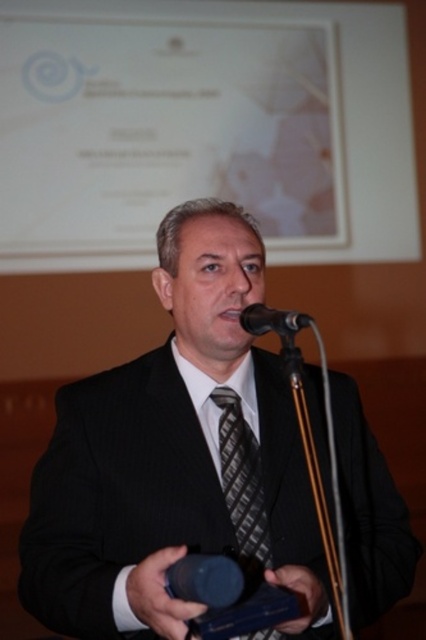
Which of these two, black textured tie at center or black matte microphone at center, stands shorter?

With less height is black matte microphone at center.

Between black textured tie at center and black matte microphone at center, which one has more height?

black textured tie at center

Measure the distance between point (250, 445) and camera.

4.44 feet

Where is `black textured tie at center`? black textured tie at center is located at coordinates (241, 477).

Is black pinstripe suit at center smaller than black textured tie at center?

No.

Is point (210, 333) closer to camera compared to point (241, 449)?

That is True.

Which is behind, point (100, 424) or point (235, 445)?

The point (235, 445) is behind.

Identify the location of black pinstripe suit at center. This screenshot has height=640, width=426. (175, 456).

Is black matte microphone at center wider than black metallic microphone at center?

No, black matte microphone at center is not wider than black metallic microphone at center.

Between black matte microphone at center and black metallic microphone at center, which one appears on the right side from the viewer's perspective?

black metallic microphone at center

The height and width of the screenshot is (640, 426). What do you see at coordinates (206, 579) in the screenshot?
I see `black matte microphone at center` at bounding box center [206, 579].

In order to click on black matte microphone at center in this screenshot , I will do `click(206, 579)`.